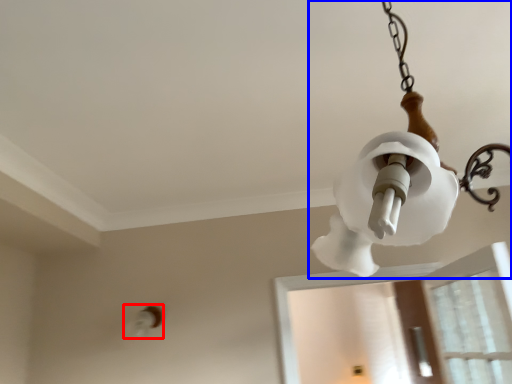
Question: Which of the following is the farthest to the observer, light fixture (highlighted by a red box) or lamp (highlighted by a blue box)?

Choices:
 (A) light fixture
 (B) lamp

Answer: (A)